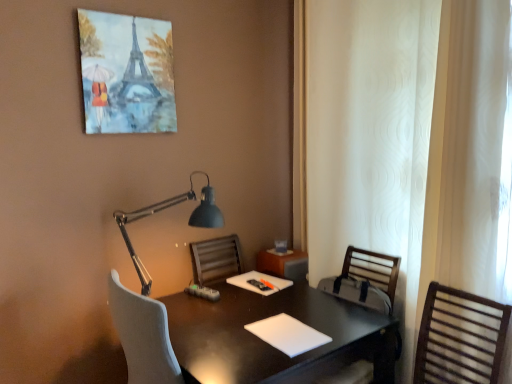
Where is `vacant area that lies between white matte notepad at center, which is the 2th notepad from front to back, and white matte notepad at center, positioned as the 2th notepad in back-to-front order`? Image resolution: width=512 pixels, height=384 pixels. vacant area that lies between white matte notepad at center, which is the 2th notepad from front to back, and white matte notepad at center, positioned as the 2th notepad in back-to-front order is located at coordinates (275, 304).